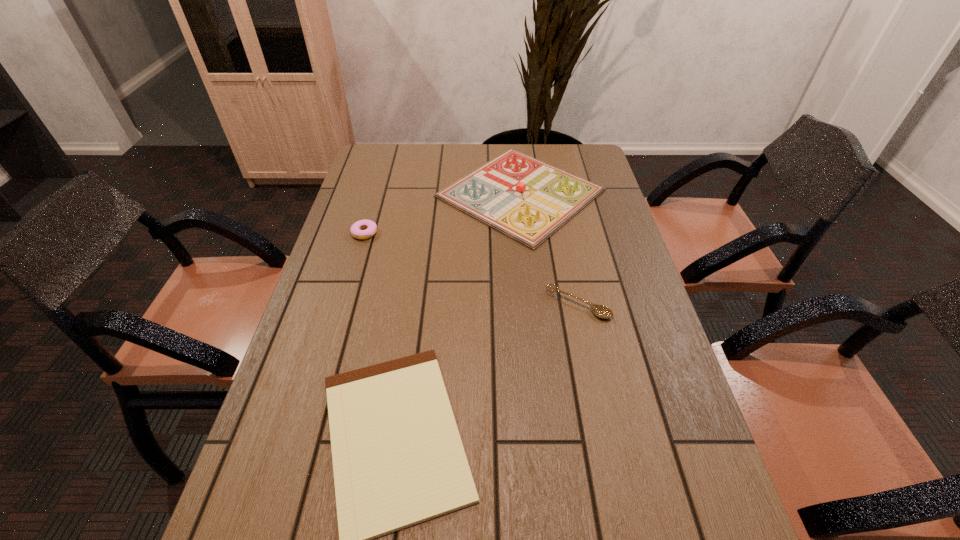
Identify the location of the second closest object relative to the doughnut. (398, 460).